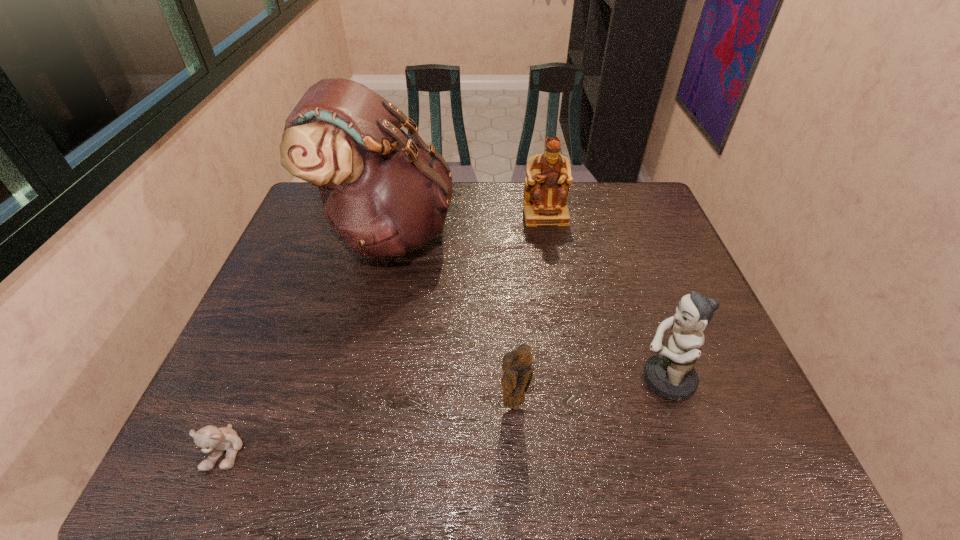
Where is `vacant space situated 0.150m on the front-facing side of the rightmost figurine`? The image size is (960, 540). vacant space situated 0.150m on the front-facing side of the rightmost figurine is located at coordinates (569, 380).

This screenshot has width=960, height=540. I want to click on vacant region located on the front-facing side of the rightmost figurine, so click(x=542, y=380).

Where is `vacant region located 0.180m on the front-facing side of the rightmost figurine`? vacant region located 0.180m on the front-facing side of the rightmost figurine is located at coordinates (556, 380).

Image resolution: width=960 pixels, height=540 pixels. I want to click on free space located 0.060m on the front-facing side of the third object from left to right, so click(x=516, y=440).

Where is `satchel located at the far edge`? Image resolution: width=960 pixels, height=540 pixels. satchel located at the far edge is located at coordinates (384, 193).

The image size is (960, 540). Find the location of `figurine present at the far edge`. figurine present at the far edge is located at coordinates (546, 189).

Identify the location of object present at the near edge. Image resolution: width=960 pixels, height=540 pixels. (211, 439).

Where is `satchel that is at the left edge`? The width and height of the screenshot is (960, 540). satchel that is at the left edge is located at coordinates (384, 193).

Identify the location of teddy bear that is at the left edge. This screenshot has width=960, height=540. (211, 439).

The image size is (960, 540). In order to click on object located at the right edge in this screenshot , I will do `click(670, 374)`.